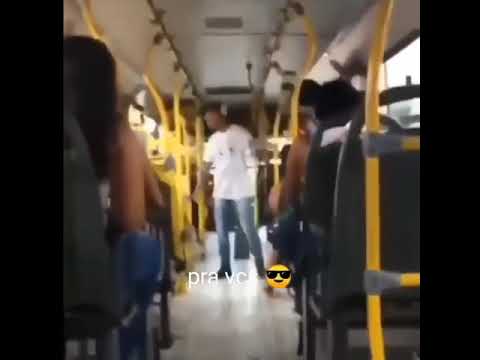
Where is `ceiling`? The image size is (480, 360). ceiling is located at coordinates (226, 63), (251, 12).